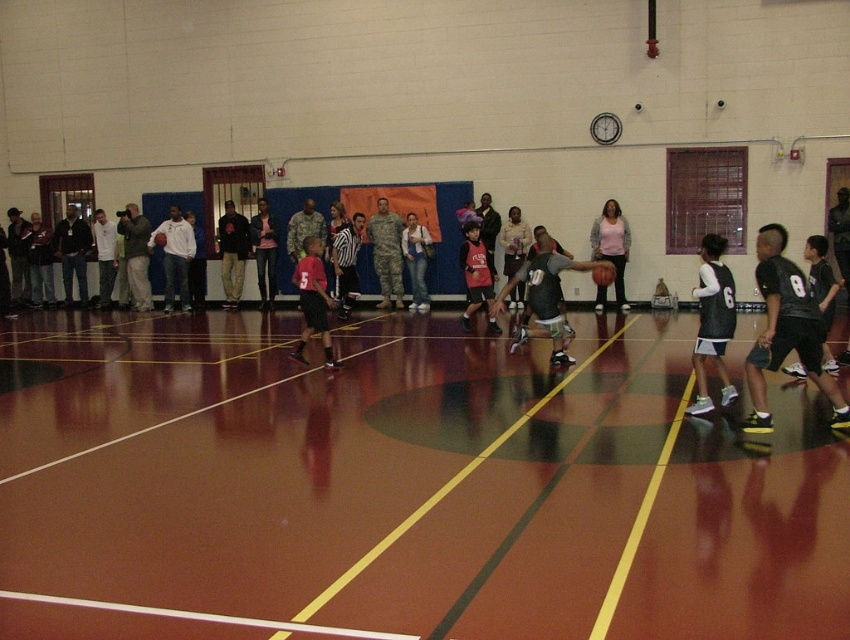
Question: Among these objects, which one is nearest to the camera?

Choices:
 (A) denim jacket at center
 (B) matte red jersey at center
 (C) matte black jacket at center
 (D) rubber textured basketball at center

Answer: (D)

Question: Can you confirm if black jersey at center is positioned to the left of rubber textured basketball at center?

Choices:
 (A) no
 (B) yes

Answer: (A)

Question: Is rubber textured basketball at center to the right of shiny orange basketball at center from the viewer's perspective?

Choices:
 (A) no
 (B) yes

Answer: (B)

Question: Can you confirm if matte red jersey at center is positioned below shiny orange basketball at center?

Choices:
 (A) no
 (B) yes

Answer: (B)

Question: Estimate the real-world distances between objects in this image. Which object is farther from the rubber textured basketball at center?

Choices:
 (A) denim jacket at center
 (B) matte black jacket at center
 (C) matte red jersey at center

Answer: (B)

Question: Which point is farther from the camera taking this photo?

Choices:
 (A) (306, 340)
 (B) (718, 372)

Answer: (A)